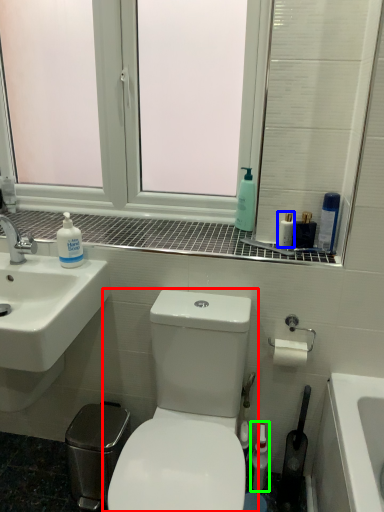
Question: Which is farther away from toilet (highlighted by a red box)? mouthwash (highlighted by a blue box) or mouthwash (highlighted by a green box)?

Choices:
 (A) mouthwash
 (B) mouthwash

Answer: (A)